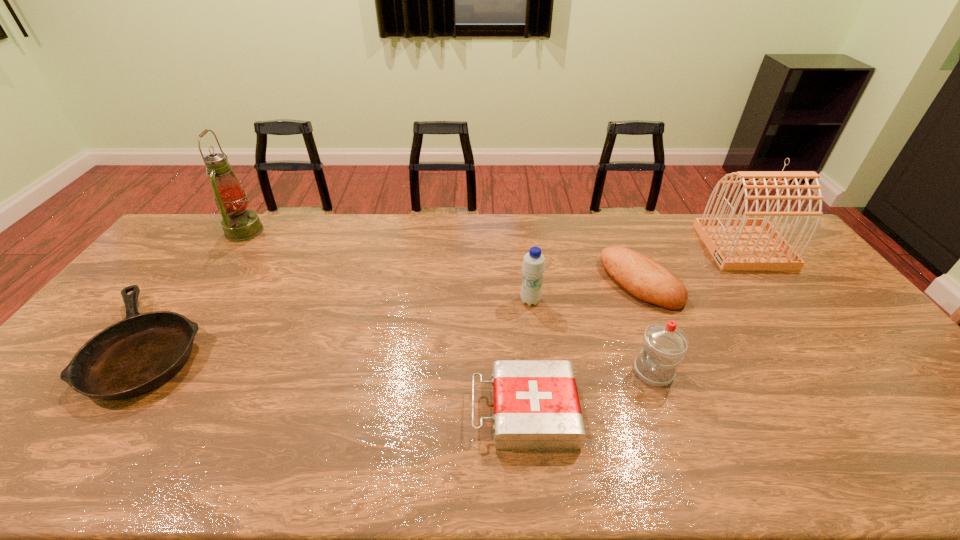
At what (x,y) coordinates should I click in order to perform the action: click on free space located 0.200m with an open door on the rightmost object. Please return your answer as a coordinate pair (x, y). This screenshot has width=960, height=540. Looking at the image, I should click on (650, 246).

Locate an element on the screen. The height and width of the screenshot is (540, 960). vacant space located 0.170m on the right of the left water bottle is located at coordinates (597, 301).

In order to click on vacant space located 0.220m on the handle side of the right water bottle in this screenshot , I will do `click(549, 372)`.

I want to click on free location located 0.340m on the handle side of the right water bottle, so click(504, 372).

Identify the location of free space located 0.380m on the handle side of the right water bottle. (489, 372).

Where is `free space located on the front of the bread`? free space located on the front of the bread is located at coordinates (665, 343).

Find the location of a particular element. The height and width of the screenshot is (540, 960). vacant point located 0.320m on the front side of the sixth tallest object is located at coordinates point(340,411).

This screenshot has width=960, height=540. In order to click on free space located on the front side of the sixth tallest object in this screenshot , I will do `click(439, 411)`.

This screenshot has width=960, height=540. I want to click on free space located on the front side of the sixth tallest object, so pos(422,411).

Where is `free spot located on the right of the frying pan`? Image resolution: width=960 pixels, height=540 pixels. free spot located on the right of the frying pan is located at coordinates coord(289,346).